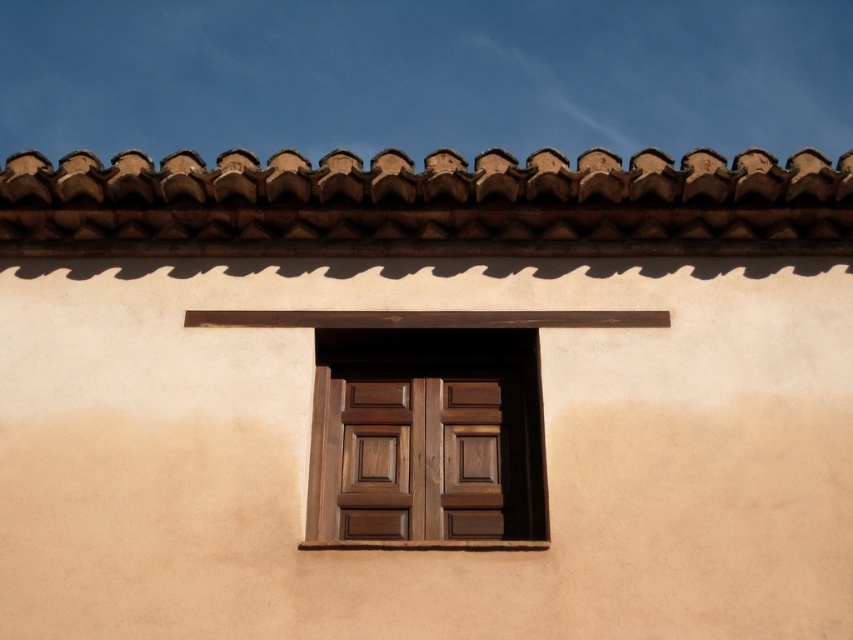
You are standing in front of a building and see the brown textured tiles at top and the dark wood window at center. Which object is located higher up on the wall?

The brown textured tiles at top is positioned over the dark wood window at center, so it is higher up on the wall.

You are standing in front of the building and looking at the exterior wall. You notice the brown textured tiles at top and the dark wood window at center. Which object is located to the left of the other?

The brown textured tiles at top are to the left of the dark wood window at center.